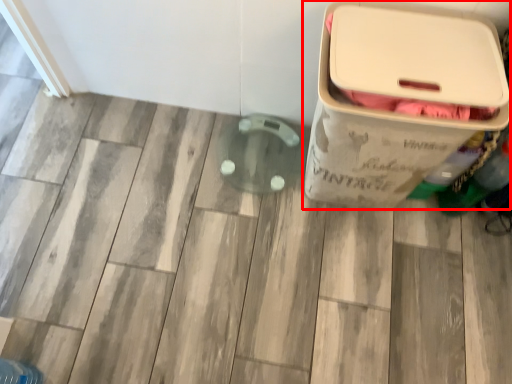
Question: From the image's perspective, considering the relative positions of waste container (annotated by the red box) and bottle in the image provided, where is waste container (annotated by the red box) located with respect to the staircase?

Choices:
 (A) below
 (B) above

Answer: (B)